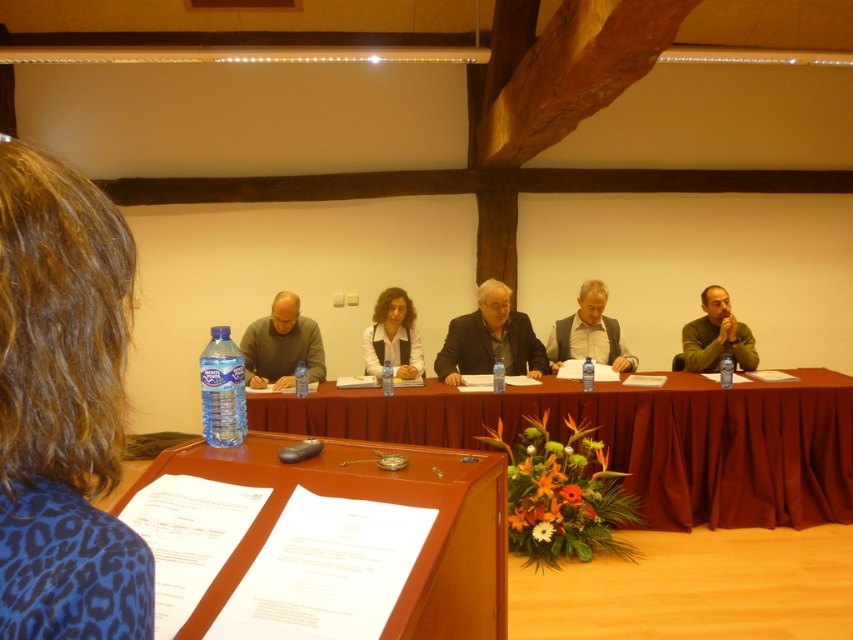
Measure the distance between brown curly hair at left and camera.

brown curly hair at left and camera are 50.75 centimeters apart from each other.

Between brown curly hair at left and transparent plastic bottle at left, which one is positioned lower?

transparent plastic bottle at left is below.

The width and height of the screenshot is (853, 640). What do you see at coordinates (62, 406) in the screenshot?
I see `brown curly hair at left` at bounding box center [62, 406].

I want to click on brown curly hair at left, so click(62, 406).

This screenshot has width=853, height=640. What do you see at coordinates (490, 339) in the screenshot?
I see `dark brown suit at center` at bounding box center [490, 339].

Does dark brown suit at center appear on the right side of matte gray shirt at center?

Yes, dark brown suit at center is to the right of matte gray shirt at center.

Is point (477, 352) less distant than point (293, 330)?

Yes, point (477, 352) is in front of point (293, 330).

Where is `dark brown suit at center`? The image size is (853, 640). dark brown suit at center is located at coordinates (490, 339).

Between dark brown suit at center and gray fabric jacket at center, which one has more height?

dark brown suit at center

Does dark brown suit at center appear on the right side of gray fabric jacket at center?

In fact, dark brown suit at center is to the left of gray fabric jacket at center.

Image resolution: width=853 pixels, height=640 pixels. What do you see at coordinates (490, 339) in the screenshot?
I see `dark brown suit at center` at bounding box center [490, 339].

Locate an element on the screen. dark brown suit at center is located at coordinates pyautogui.click(x=490, y=339).